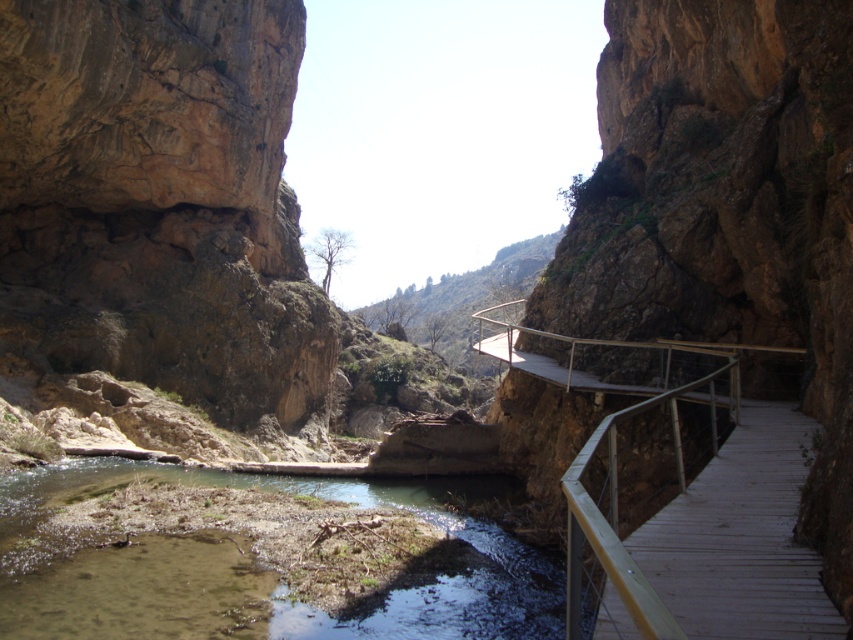
Does green mossy river at lower left lie behind wooden walkway at center?

Yes, green mossy river at lower left is further from the viewer.

Where is `green mossy river at lower left`? The width and height of the screenshot is (853, 640). green mossy river at lower left is located at coordinates (254, 579).

Does point (281, 484) come in front of point (763, 547)?

No, it is behind (763, 547).

You are a GUI agent. You are given a task and a screenshot of the screen. Output one action in this format:
    pyautogui.click(x=<x>, y=<y>)
    Task: Click on the green mossy river at lower left
    This screenshot has height=640, width=853.
    Given the screenshot: What is the action you would take?
    pyautogui.click(x=254, y=579)